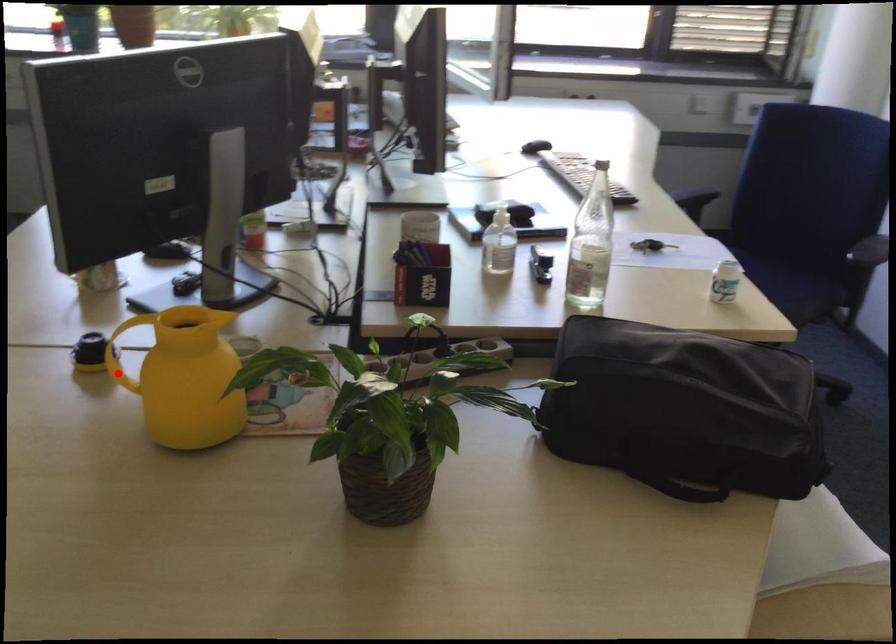
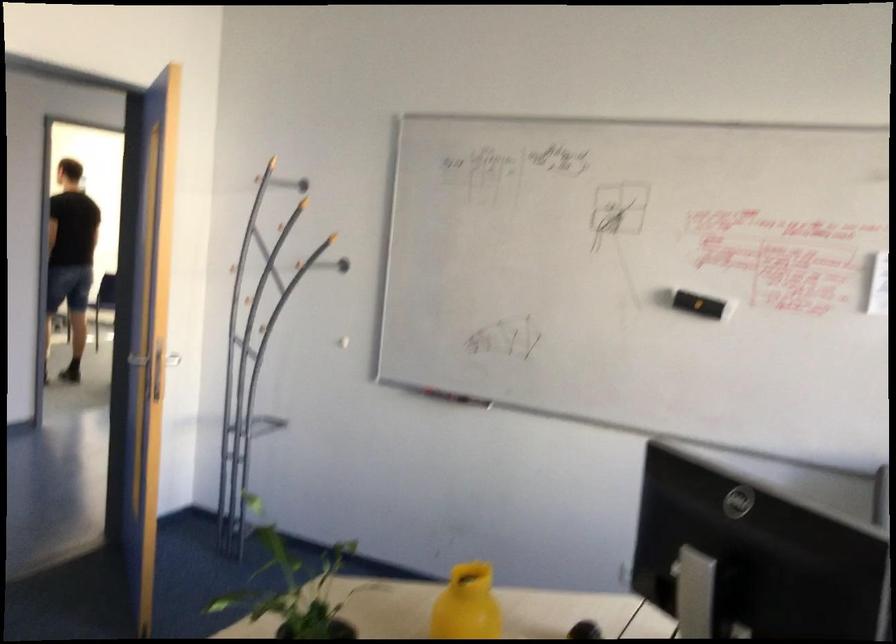
Question: I am providing you with two images of the same scene from different viewpoints. Image1 has a red point marked. In image2, the corresponding 3D location appears at what relative position? Reply with the corresponding letter.

Choices:
 (A) Closer
 (B) Farther

Answer: (B)